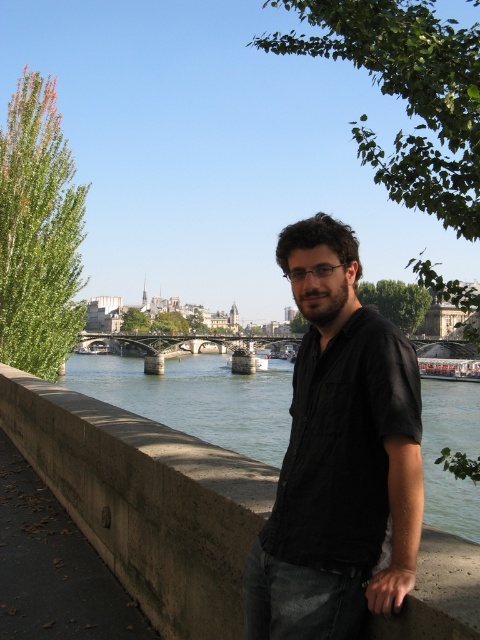
You are a photographer standing at the riverside. You want to take a photo of the black matte shirt at center and the concrete bridge at center. Which object should you focus on first if you want the one closer to you to be sharp?

The black matte shirt at center is in front of the concrete bridge at center, so you should focus on the black matte shirt at center first to ensure it is sharp.

Looking at this image, you are a photographer standing on the concrete ledge at center and want to take a photo of the concrete bridge at center. Given that your camera has a maximum range of 200 feet, will you be able to capture the bridge without moving closer?

The distance between the concrete ledge at center and the concrete bridge at center is 261.98 feet, which exceeds the camera maximum range of 200 feet. Therefore, you will not be able to capture the bridge without moving closer.